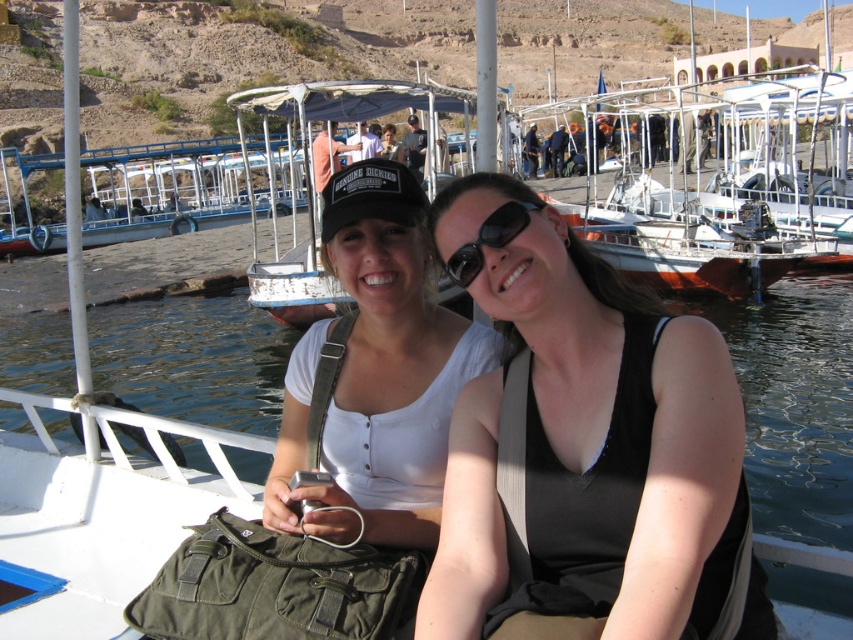
Question: Which point appears farthest from the camera in this image?

Choices:
 (A) (799, 412)
 (B) (381, 150)
 (C) (532, 560)

Answer: (B)

Question: Which object appears closest to the camera in this image?

Choices:
 (A) black fabric tank top at center
 (B) white fabric tank top at center
 (C) clear water at boat front

Answer: (A)

Question: Which object is the farthest from the clear water at boat front?

Choices:
 (A) black reflective sunglasses at center
 (B) black fabric tank top at center
 (C) white wooden boat at center

Answer: (B)

Question: Does clear water at boat front have a greater width compared to white fabric tank top at center?

Choices:
 (A) yes
 (B) no

Answer: (A)

Question: Is black fabric tank top at center wider than matte black cap at upper center?

Choices:
 (A) yes
 (B) no

Answer: (B)

Question: Does black fabric tank top at center appear over clear water at boat front?

Choices:
 (A) no
 (B) yes

Answer: (A)